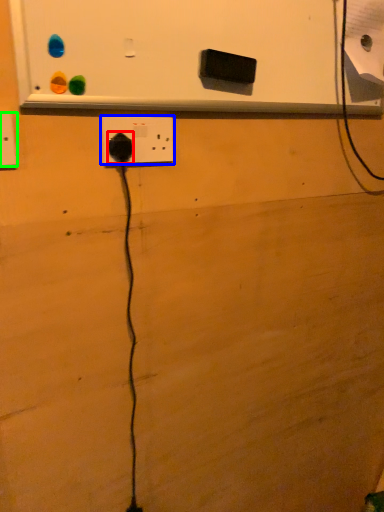
Question: Which object is the farthest from power plugs and sockets (highlighted by a red box)? Choose among these: power plugs and sockets (highlighted by a blue box) or power plugs and sockets (highlighted by a green box).

Choices:
 (A) power plugs and sockets
 (B) power plugs and sockets

Answer: (B)